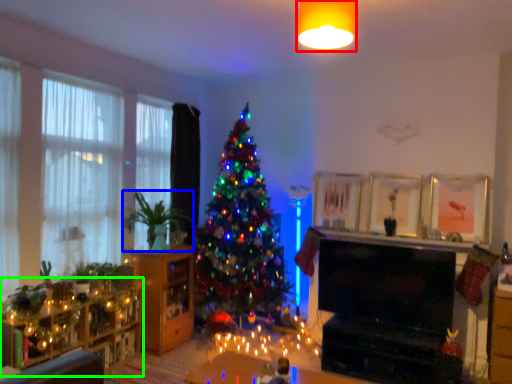
Question: Which object is positioned closest to light fixture (highlighted by a red box)? Select from plant (highlighted by a blue box) and dresser (highlighted by a green box).

Choices:
 (A) plant
 (B) dresser

Answer: (A)